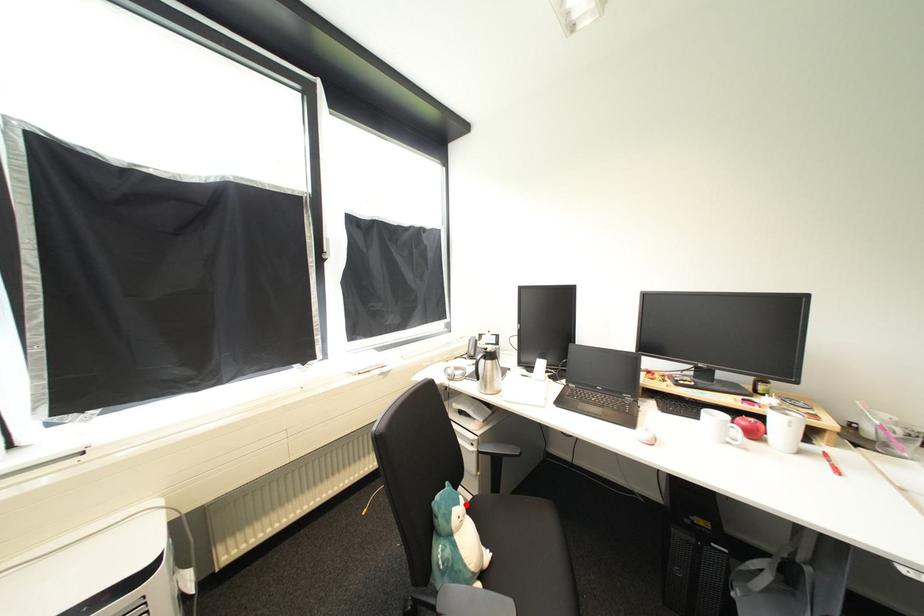
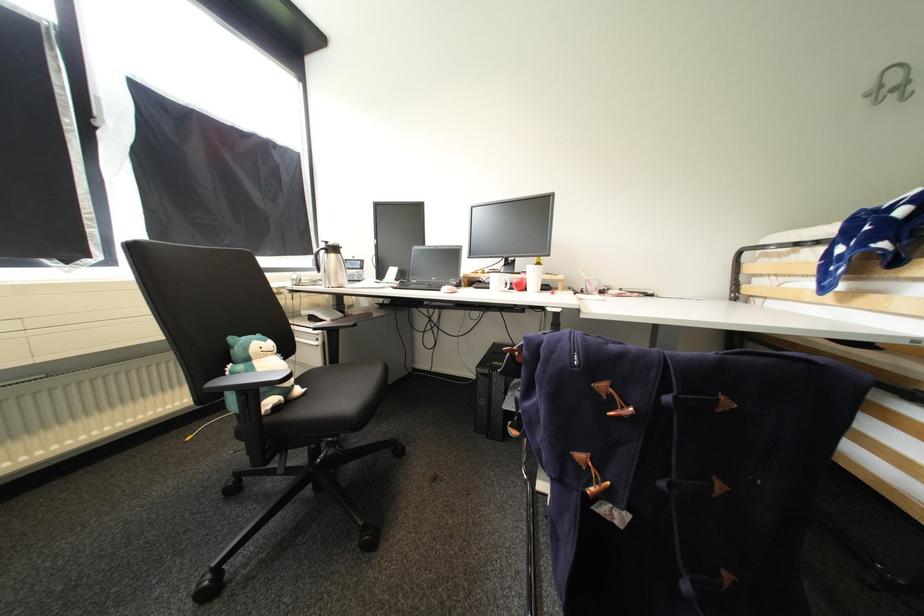
The point at the highlighted location is marked in the first image. Where is the corresponding point in the second image?

(272, 342)